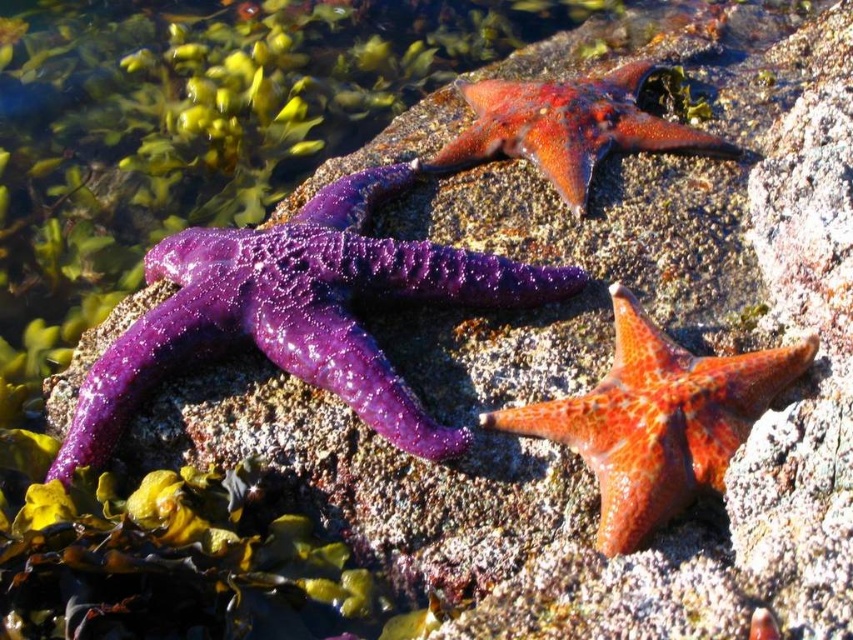
From the picture: Between shiny orange starfish at center and shiny orange starfish at upper center, which one has more height?

shiny orange starfish at upper center

Does point (700, 410) come farther from viewer compared to point (625, 148)?

No, (700, 410) is in front of (625, 148).

Which is in front, point (755, 404) or point (479, 131)?

Point (755, 404) is in front.

Locate an element on the screen. This screenshot has height=640, width=853. shiny orange starfish at center is located at coordinates (657, 420).

Can you confirm if purple wet starfish at left is taller than shiny orange starfish at upper center?

Yes, purple wet starfish at left is taller than shiny orange starfish at upper center.

Describe the element at coordinates (299, 314) in the screenshot. This screenshot has width=853, height=640. I see `purple wet starfish at left` at that location.

Locate an element on the screen. The height and width of the screenshot is (640, 853). purple wet starfish at left is located at coordinates (299, 314).

In the scene shown: Does purple wet starfish at left appear on the right side of shiny orange starfish at center?

No, purple wet starfish at left is not to the right of shiny orange starfish at center.

Does purple wet starfish at left have a smaller size compared to shiny orange starfish at center?

Incorrect, purple wet starfish at left is not smaller in size than shiny orange starfish at center.

This screenshot has height=640, width=853. In order to click on purple wet starfish at left in this screenshot , I will do `click(299, 314)`.

Locate an element on the screen. The height and width of the screenshot is (640, 853). purple wet starfish at left is located at coordinates (299, 314).